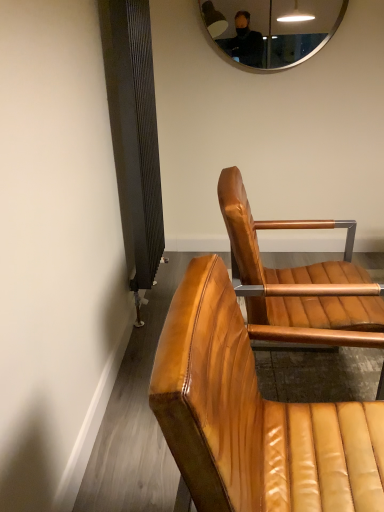
Question: Based on their sizes in the image, would you say leather chair at center, which is the second chair from back to front, is bigger or smaller than silver metallic mirror at upper center?

Choices:
 (A) small
 (B) big

Answer: (B)

Question: Based on their positions, is leather chair at center, arranged as the first chair when viewed from the front, located to the left or right of silver metallic mirror at upper center?

Choices:
 (A) right
 (B) left

Answer: (B)

Question: Based on their relative distances, which object is nearer to the silver metallic mirror at upper center?

Choices:
 (A) shiny brown leather chair at center, marked as the second chair in a front-to-back arrangement
 (B) leather chair at center, which is the second chair from back to front

Answer: (A)

Question: Estimate the real-world distances between objects in this image. Which object is farther from the leather chair at center, arranged as the first chair when viewed from the front?

Choices:
 (A) shiny brown leather chair at center, the first chair when ordered from back to front
 (B) silver metallic mirror at upper center

Answer: (B)